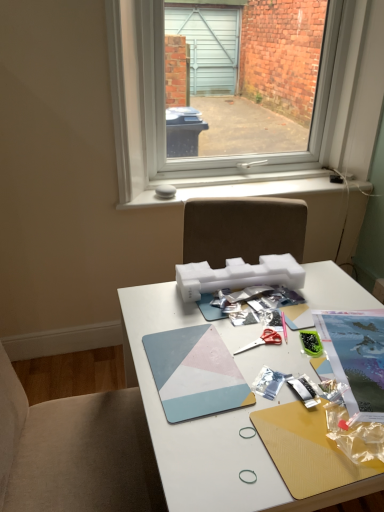
This screenshot has height=512, width=384. What are the coordinates of `vacant region to the right of green plastic container at center-right` in the screenshot? It's located at (351, 339).